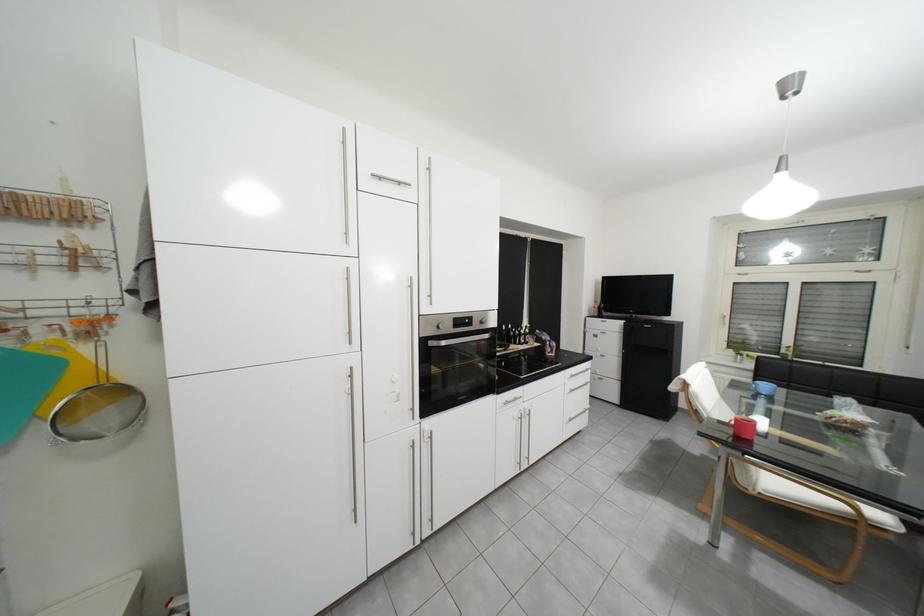
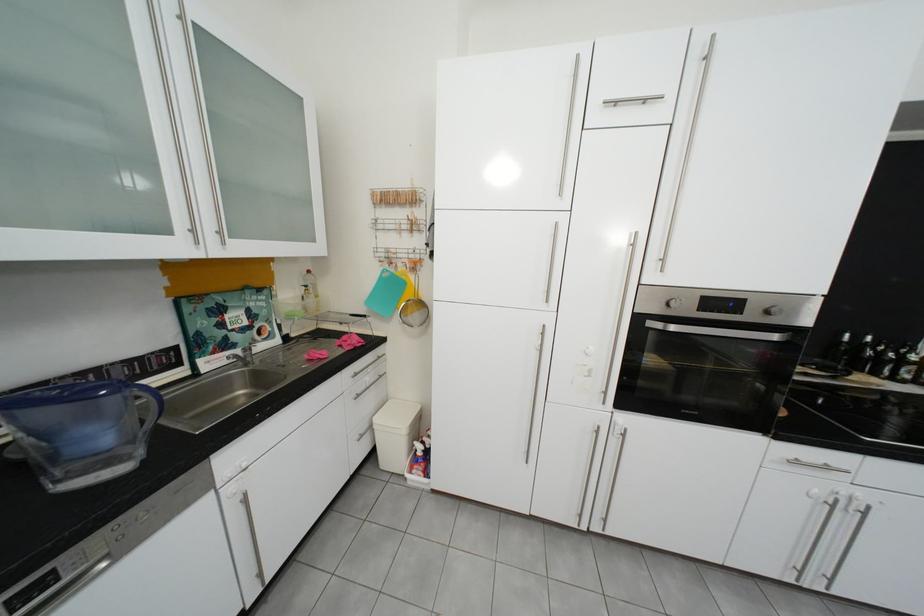
Locate, in the second image, the point that corresponds to the point at 26,306 in the first image.

(406, 252)